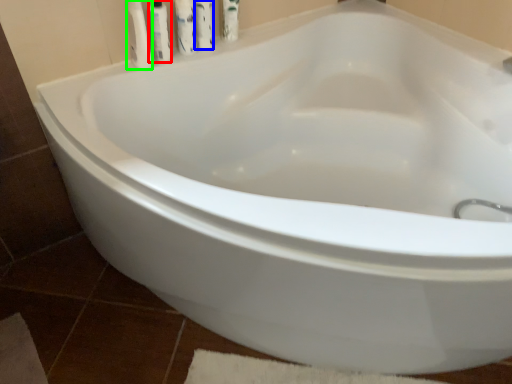
Question: Which object is the farthest from toiletry (highlighted by a red box)? Choose among these: cleaning product (highlighted by a blue box) or toiletry (highlighted by a green box).

Choices:
 (A) cleaning product
 (B) toiletry

Answer: (A)